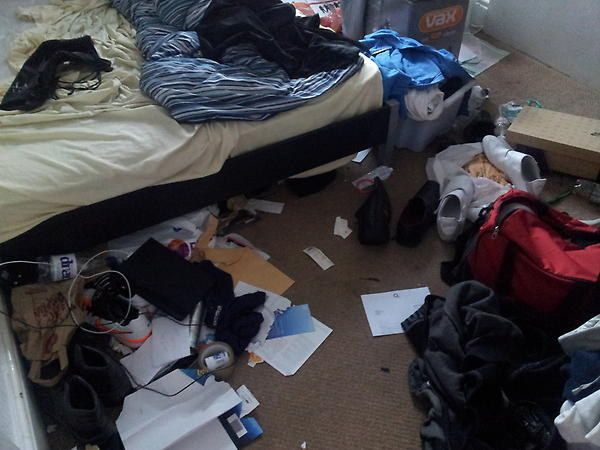
Find the location of `floor`. floor is located at coordinates (344, 403).